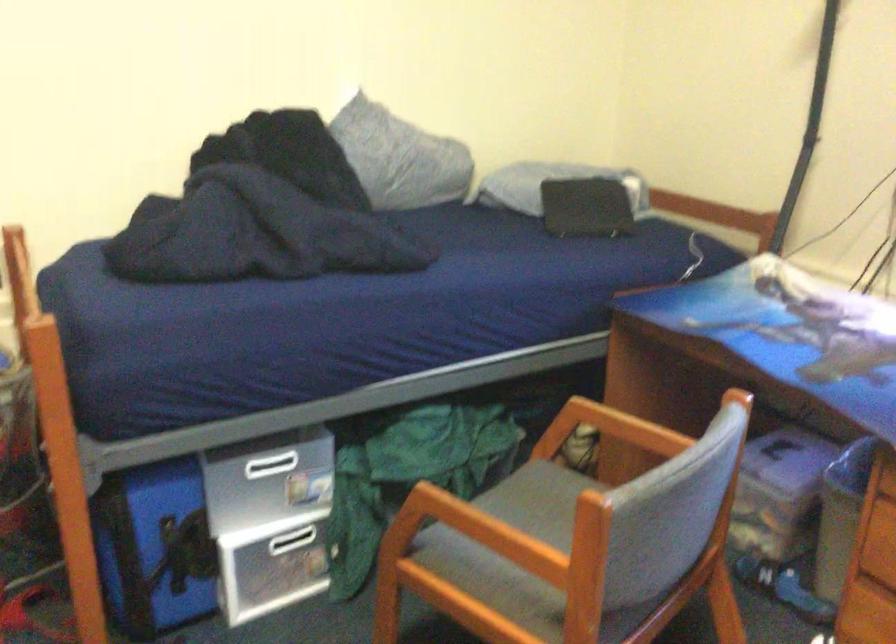
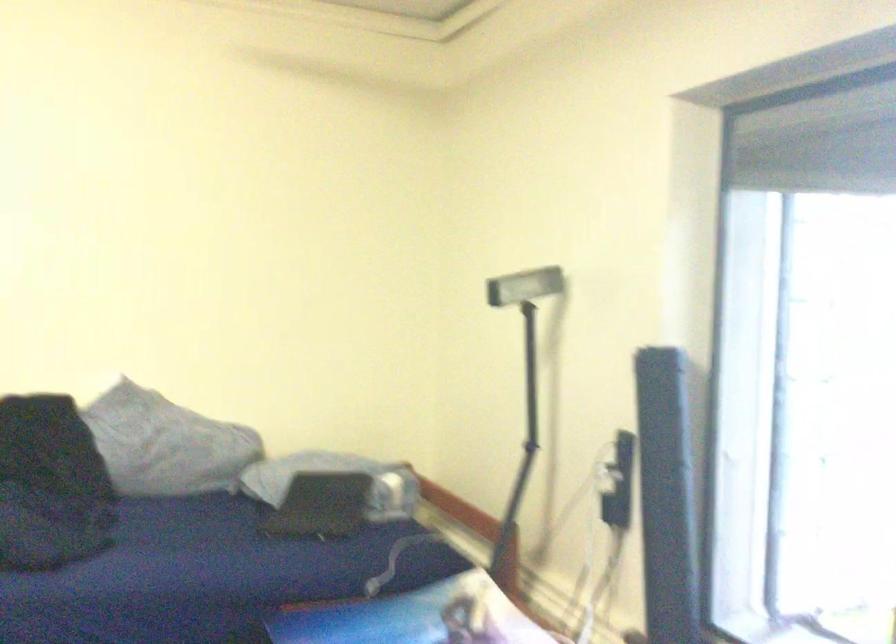
Question: The first image is from the beginning of the video and the second image is from the end. How did the camera likely rotate when shooting the video?

Choices:
 (A) Left
 (B) Right
 (C) Up
 (D) Down

Answer: (C)